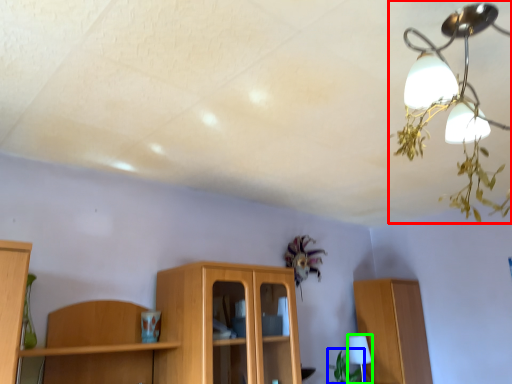
Question: Which object is positioned farthest from lamp (highlighted by a red box)? Select from plant (highlighted by a blue box) and table lamp (highlighted by a green box).

Choices:
 (A) plant
 (B) table lamp

Answer: (A)